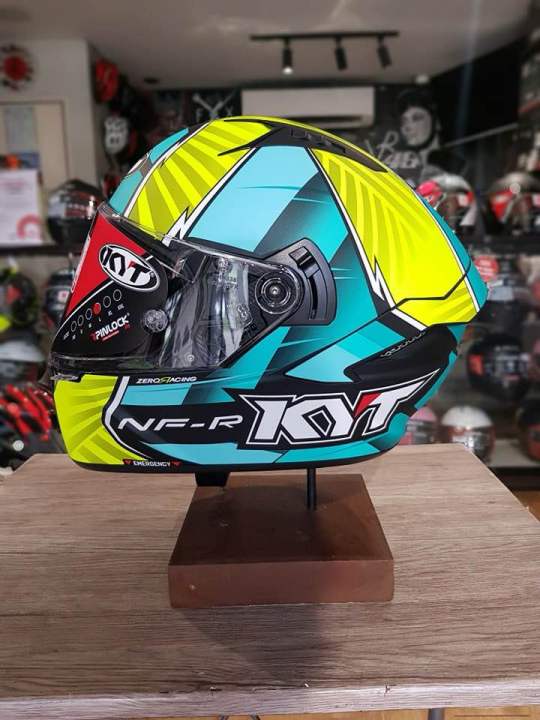
Image resolution: width=540 pixels, height=720 pixels. What are the coordinates of `floor` in the screenshot? It's located at (532, 500), (494, 711).